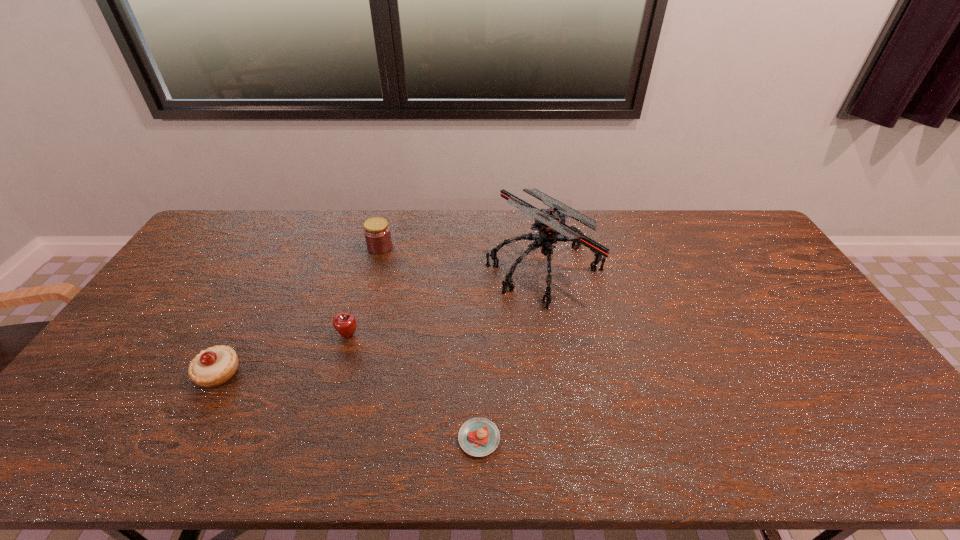
Where is `the tallest object`? The image size is (960, 540). the tallest object is located at coordinates (550, 223).

This screenshot has height=540, width=960. I want to click on the second tallest object, so click(377, 233).

Identify the location of the leftmost object. This screenshot has height=540, width=960. (212, 367).

I want to click on the left pastry, so click(x=212, y=367).

Find the location of a particular element. apple is located at coordinates (345, 324).

I want to click on the right pastry, so click(478, 437).

The width and height of the screenshot is (960, 540). Find the location of `the nearest object`. the nearest object is located at coordinates (478, 437).

Where is `vacant space situated on the front of the tallest object`? vacant space situated on the front of the tallest object is located at coordinates (554, 327).

Where is `vacant area situated 0.390m on the left of the jam`? Image resolution: width=960 pixels, height=540 pixels. vacant area situated 0.390m on the left of the jam is located at coordinates (257, 247).

Find the location of a particular element. This screenshot has height=540, width=960. free space located on the back of the taller pastry is located at coordinates (276, 266).